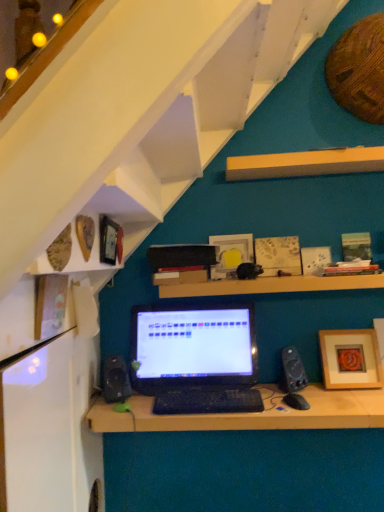
You are a GUI agent. You are given a task and a screenshot of the screen. Output one action in this format:
    pyautogui.click(x=<x>, y=<y>)
    Task: Click on the vacant area that is in front of black matte speaker at right, which is the second loudspeaker in left-to-right order
    The height and width of the screenshot is (512, 384).
    Given the screenshot: What is the action you would take?
    pyautogui.click(x=298, y=402)